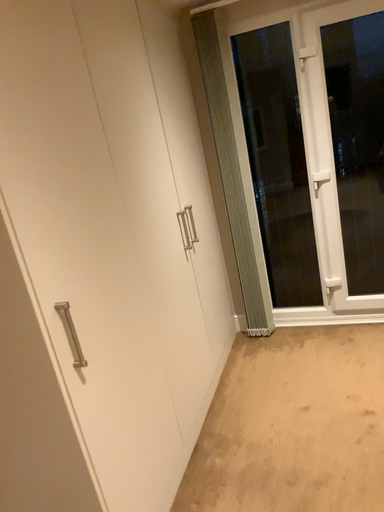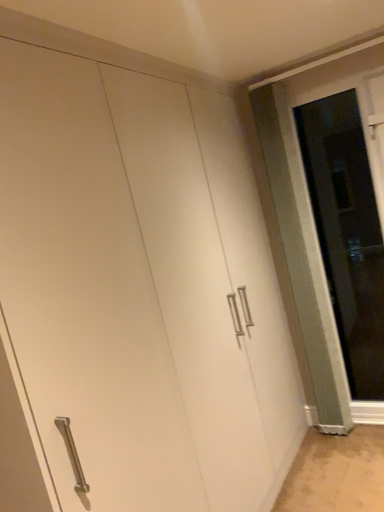
Question: Which way did the camera rotate in the video?

Choices:
 (A) rotated left
 (B) rotated right

Answer: (A)